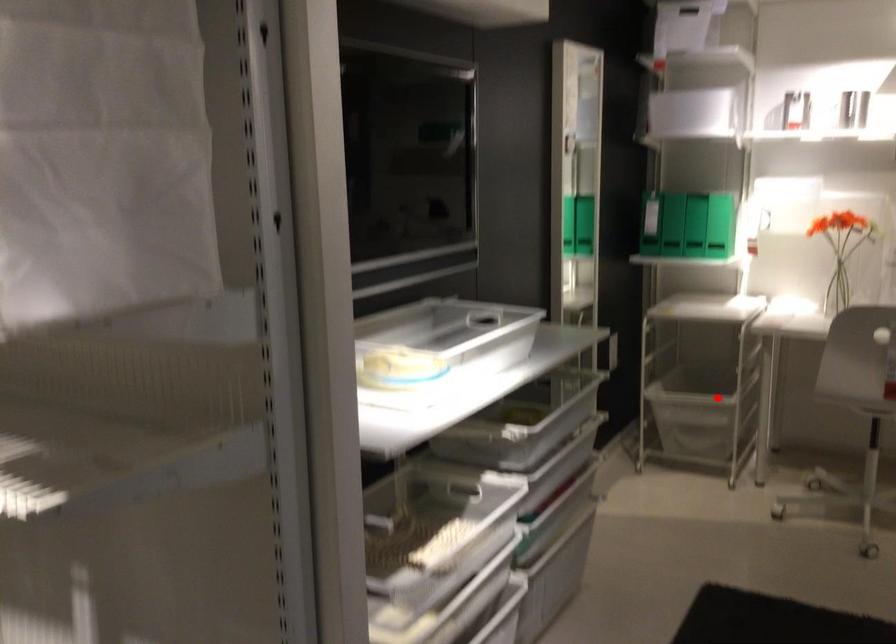
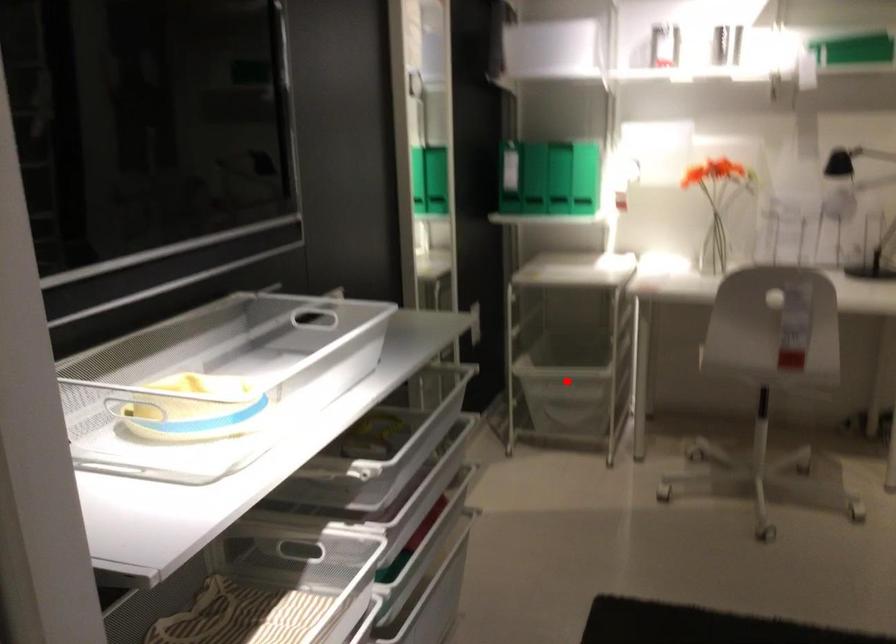
I am providing you with two images of the same scene from different viewpoints. A red point is marked on the first image and another point is marked on the second image. Are the points marked in image1 and image2 representing the same 3D position?

Yes